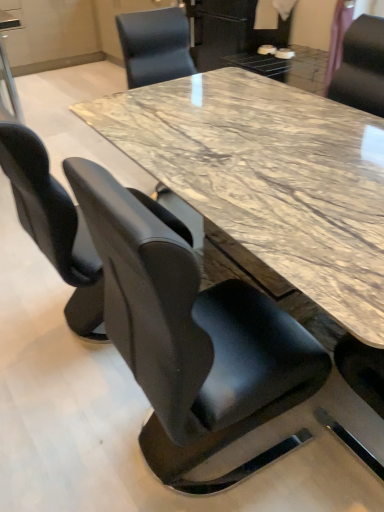
Question: From a real-world perspective, is black leather chair at upper right, positioned as the 3th chair in front-to-back order, positioned above or below black leather chair at center, the 1th chair when ordered from front to back?

Choices:
 (A) below
 (B) above

Answer: (B)

Question: In terms of size, does black leather chair at upper right, which appears as the third chair when viewed from the left, appear bigger or smaller than black leather chair at center, which is the 2th chair from right to left?

Choices:
 (A) small
 (B) big

Answer: (A)

Question: Based on their relative distances, which object is farther from the black leather chair at left, which is the 2th chair in front-to-back order?

Choices:
 (A) black leather chair at upper right, acting as the 1th chair starting from the right
 (B) black leather chair at center, the 1th chair when ordered from front to back

Answer: (A)

Question: Considering the real-world distances, which object is closest to the black leather chair at center, which is the 2th chair from right to left?

Choices:
 (A) black leather chair at left, which ranks as the 2th chair in back-to-front order
 (B) black leather chair at upper right, which appears as the third chair when viewed from the left

Answer: (A)